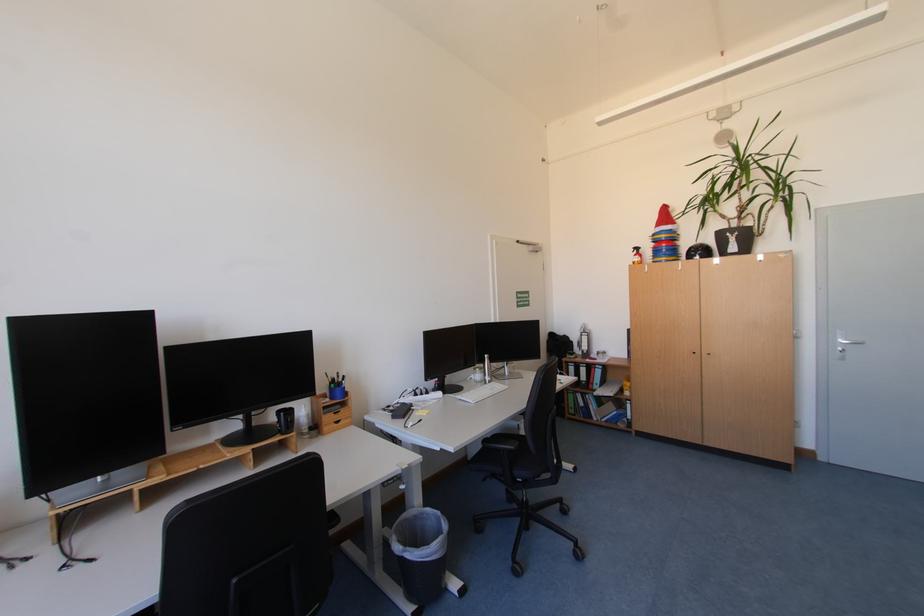
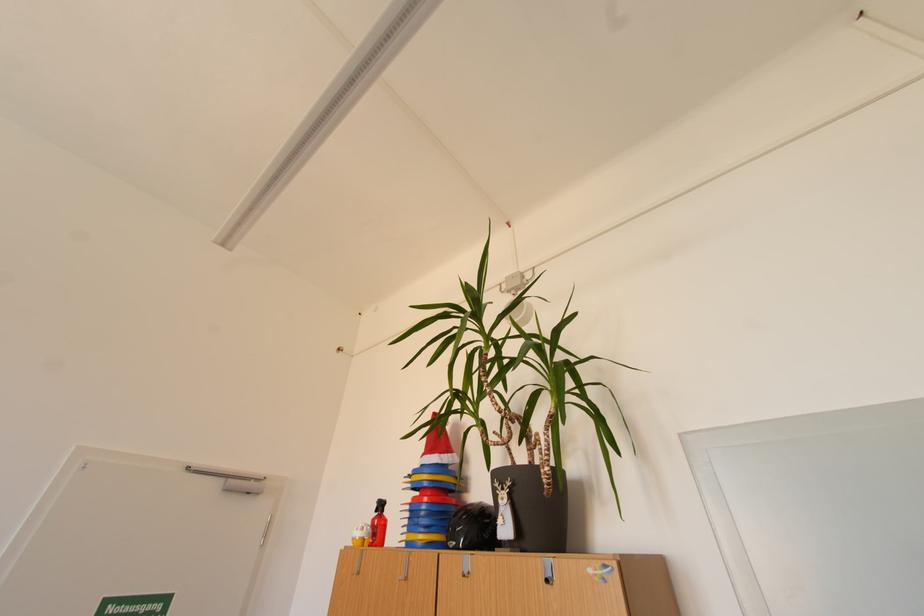
The point at (745, 235) is marked in the first image. Where is the corresponding point in the second image?

(517, 485)